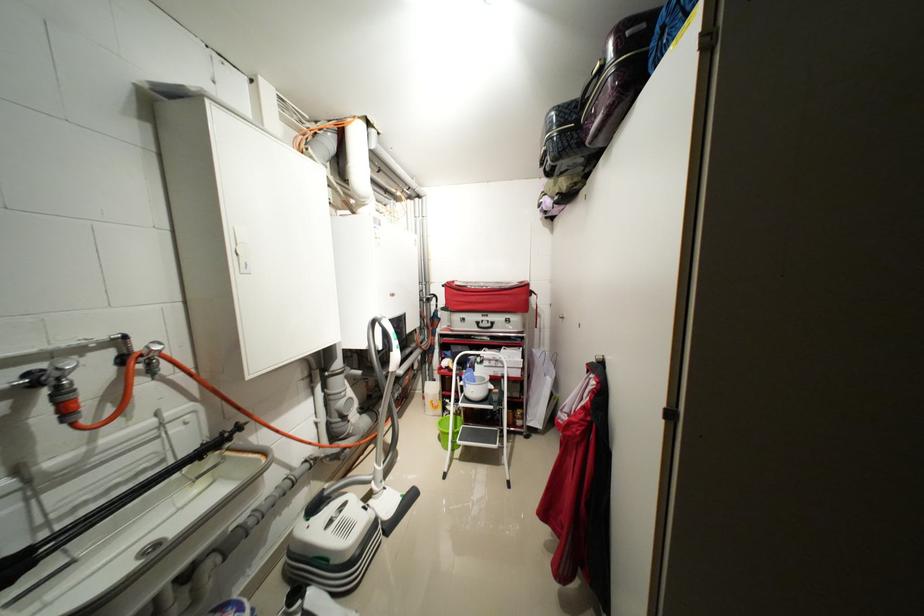
At what (x,y) coordinates should I click in order to perform the action: click on silver tap handle. Please return your answer as a coordinate pair (x, y). Looking at the image, I should click on (62, 369).